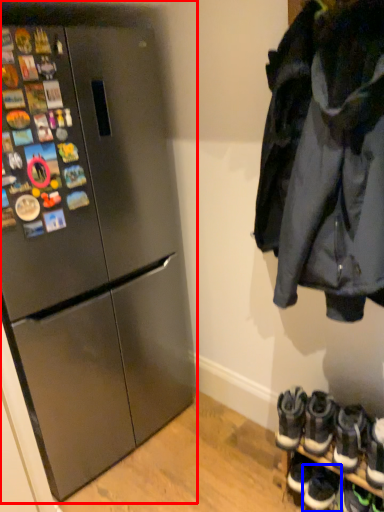
Question: Which object appears closest to the camera in this image, refrigerator (highlighted by a red box) or footwear (highlighted by a blue box)?

Choices:
 (A) refrigerator
 (B) footwear

Answer: (A)